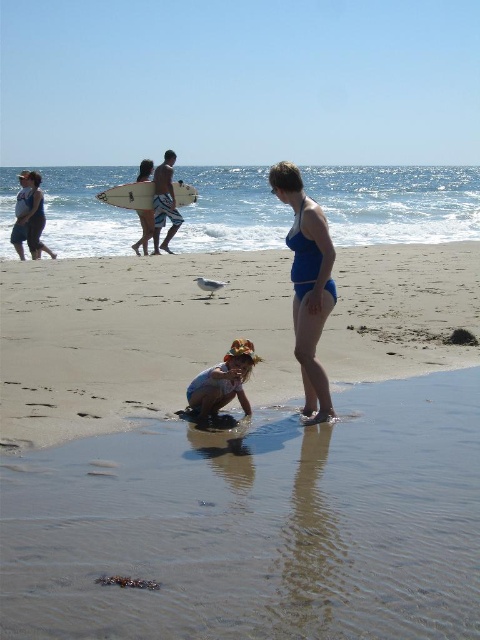
Between blue water at upper center and matte black swimsuit at left, which one is positioned higher?

blue water at upper center

Is point (99, 241) positioned behind point (31, 252)?

Yes, point (99, 241) is behind point (31, 252).

The height and width of the screenshot is (640, 480). I want to click on blue water at upper center, so click(x=396, y=202).

Between white surfboard at center and matte black swimsuit at left, which one is positioned higher?

white surfboard at center is above.

Between white surfboard at center and matte black swimsuit at left, which one has less height?

matte black swimsuit at left is shorter.

Is point (156, 241) in front of point (32, 209)?

No, it is not.

Locate an element on the screen. The image size is (480, 640). white surfboard at center is located at coordinates (165, 202).

Is blue denim shorts at lower center closer to the viewer compared to white foam surfboard at upper center?

Yes, it is in front of white foam surfboard at upper center.

Can you confirm if blue denim shorts at lower center is positioned to the right of white foam surfboard at upper center?

Correct, you'll find blue denim shorts at lower center to the right of white foam surfboard at upper center.

Between point (220, 385) and point (149, 236), which one is positioned in front?

Positioned in front is point (220, 385).

Find the location of `blue denim shorts at lower center`. blue denim shorts at lower center is located at coordinates (223, 381).